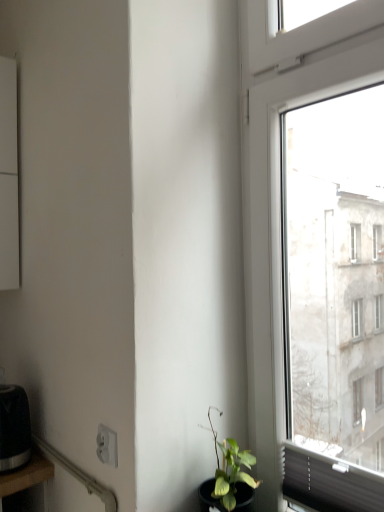
Question: From a real-world perspective, does black matte toaster at lower left stand above black wood table at lower left?

Choices:
 (A) yes
 (B) no

Answer: (A)

Question: Could you tell me if black matte toaster at lower left is facing black wood table at lower left?

Choices:
 (A) yes
 (B) no

Answer: (B)

Question: From the image's perspective, does black matte toaster at lower left appear higher than black wood table at lower left?

Choices:
 (A) no
 (B) yes

Answer: (B)

Question: Considering the relative sizes of black matte toaster at lower left and black wood table at lower left in the image provided, is black matte toaster at lower left smaller than black wood table at lower left?

Choices:
 (A) no
 (B) yes

Answer: (B)

Question: Would you say black matte toaster at lower left contains black wood table at lower left?

Choices:
 (A) no
 (B) yes

Answer: (A)

Question: Is black matte toaster at lower left not near black wood table at lower left?

Choices:
 (A) no
 (B) yes

Answer: (A)

Question: Is there a large distance between black wood table at lower left and black matte toaster at lower left?

Choices:
 (A) no
 (B) yes

Answer: (A)

Question: Is black wood table at lower left at the right side of black matte toaster at lower left?

Choices:
 (A) no
 (B) yes

Answer: (A)

Question: Is the depth of black wood table at lower left less than that of black matte toaster at lower left?

Choices:
 (A) no
 (B) yes

Answer: (B)

Question: Can you confirm if black wood table at lower left is wider than black matte toaster at lower left?

Choices:
 (A) yes
 (B) no

Answer: (A)

Question: Can you confirm if black wood table at lower left is positioned to the left of black matte toaster at lower left?

Choices:
 (A) yes
 (B) no

Answer: (A)

Question: Considering the relative sizes of black wood table at lower left and black matte toaster at lower left in the image provided, is black wood table at lower left smaller than black matte toaster at lower left?

Choices:
 (A) yes
 (B) no

Answer: (B)

Question: Is white plastic power plugs and sockets at lower left located within black wood table at lower left?

Choices:
 (A) no
 (B) yes

Answer: (A)